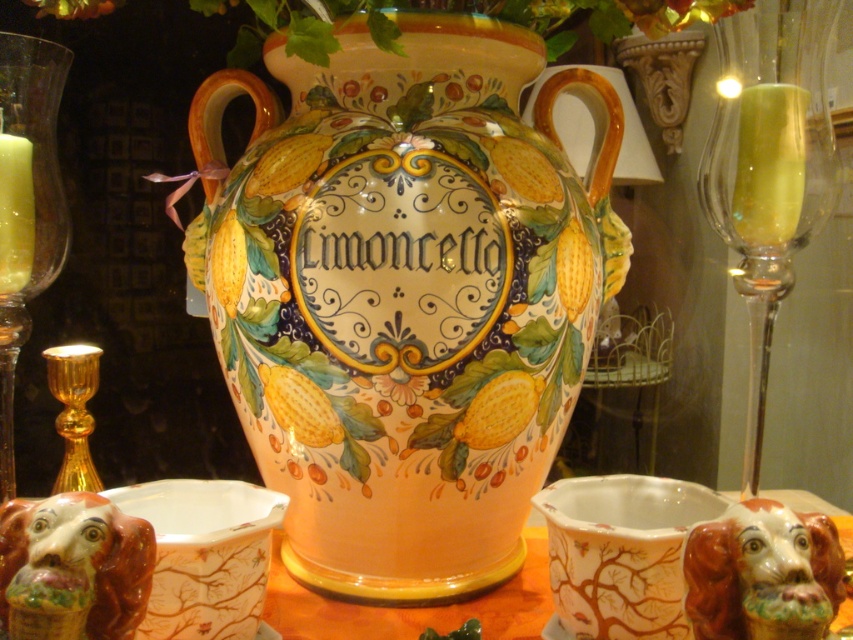
Is transparent glass wine glass at upper right above gold metallic candle holder at left?

Indeed, transparent glass wine glass at upper right is positioned over gold metallic candle holder at left.

The height and width of the screenshot is (640, 853). In order to click on transparent glass wine glass at upper right in this screenshot , I will do `click(769, 168)`.

Is point (277, 1) in front of point (737, 198)?

No, (277, 1) is further to viewer.

Looking at this image, can you confirm if green leafy plant at upper center is smaller than transparent glass at upper right?

No, green leafy plant at upper center is not smaller than transparent glass at upper right.

This screenshot has width=853, height=640. I want to click on green leafy plant at upper center, so click(x=454, y=12).

Which of these two, transparent glass wine glass at upper right or green leafy plant at upper center, stands shorter?

Standing shorter between the two is green leafy plant at upper center.

Does point (811, 164) lie in front of point (445, 4)?

That is True.

Locate an element on the screen. transparent glass wine glass at upper right is located at coordinates click(769, 168).